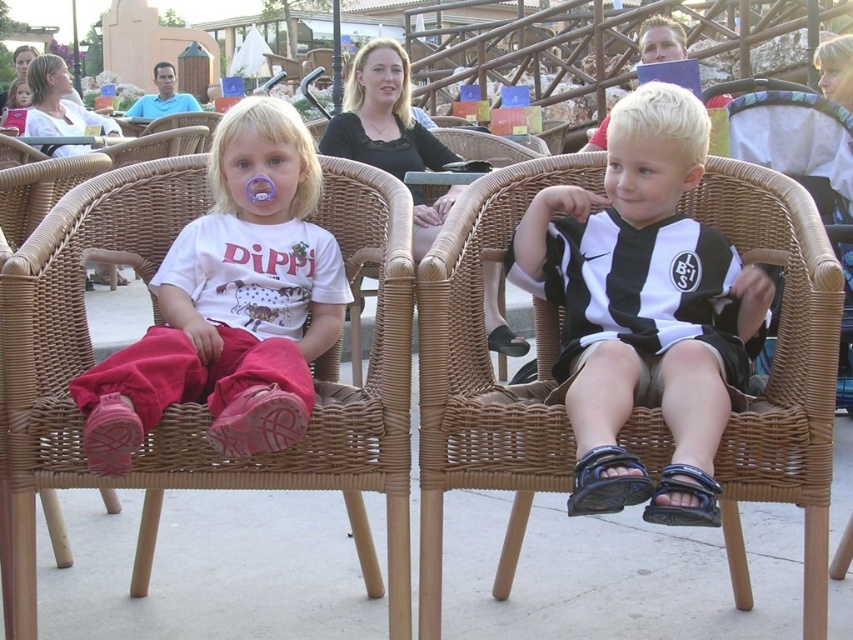
You are standing at the position of the child on the left. Which of the two points, point [689,259] or point [322,298], is closer to you?

Point [689,259] is closer to you because it is in front of point [322,298].

In the scene shown: You are standing at the origin point in the amusement park scene. There are two points marked in the image. Which point is closer to you, point (405, 326) or point (299, 416)?

Point (299, 416) is closer to you because it is in front of point (405, 326).

You are a photographer setting up a tripod to take a photo of the woven wood chair at left and the matte white shirt at center. The tripod has a height adjustment limit of 1.2 meters. Can you position the tripod so that both objects are fully visible without needing to tilt the camera upwards or downwards?

The woven wood chair at left is taller than the matte white shirt at center. Since the tripod has a height limit of 1.2 meters, if the tallest object, the woven wood chair at left, is within this height, both can be framed without tilting. However, if the chair exceeds 1.2 meters, the camera might need adjustment. The description doesn